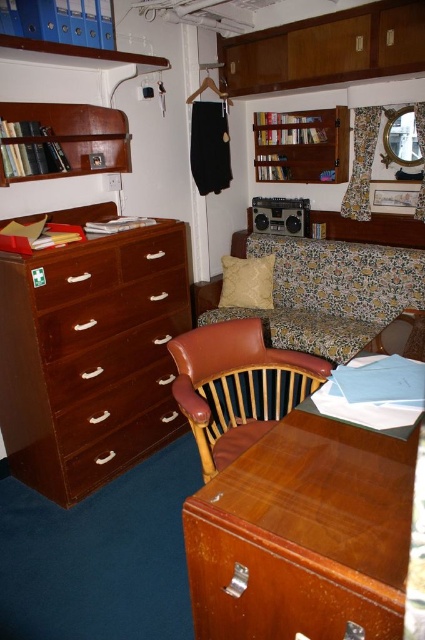
Which is below, floral fabric couch at center or matte brown drawer at lower left?

matte brown drawer at lower left

Who is higher up, floral fabric couch at center or matte brown drawer at lower left?

Positioned higher is floral fabric couch at center.

Which is behind, point (356, 340) or point (127, 464)?

Positioned behind is point (356, 340).

Locate an element on the screen. The width and height of the screenshot is (425, 640). floral fabric couch at center is located at coordinates (323, 292).

Is point (8, 179) farther from viewer compared to point (81, 433)?

That is False.

Can you confirm if wooden bookshelf at upper left is thinner than matte wood drawer at lower left?

No.

Who is more distant from viewer, [87,168] or [159,374]?

The point [87,168] is behind.

This screenshot has height=640, width=425. Find the location of `wooden bookshelf at upper left`. wooden bookshelf at upper left is located at coordinates (70, 138).

Based on the photo, does shiny brown wood file cabinet at left have a greater width compared to matte brown drawer at left?

Indeed, shiny brown wood file cabinet at left has a greater width compared to matte brown drawer at left.

The width and height of the screenshot is (425, 640). I want to click on shiny brown wood file cabinet at left, so click(90, 356).

You are a GUI agent. You are given a task and a screenshot of the screen. Output one action in this format:
    pyautogui.click(x=<x>, y=<y>)
    Task: Click on the shiny brown wood file cabinet at left
    The height and width of the screenshot is (640, 425).
    Given the screenshot: What is the action you would take?
    pyautogui.click(x=90, y=356)